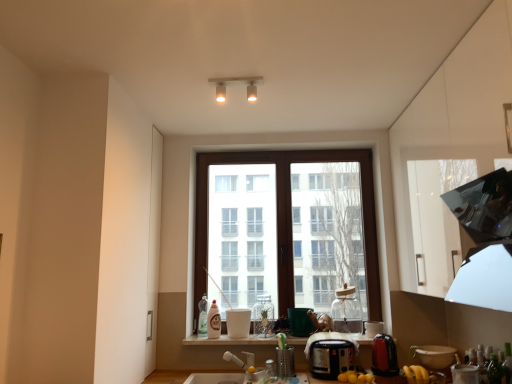
What do you see at coordinates (202, 316) in the screenshot? Image resolution: width=512 pixels, height=384 pixels. I see `translucent plastic bottle at window, which appears as the fourth bottle when viewed from the right` at bounding box center [202, 316].

You are a GUI agent. You are given a task and a screenshot of the screen. Output one action in this format:
    pyautogui.click(x=<x>, y=<y>)
    Task: Click on the white glossy bottle at center, the 3th bottle from the right
    The image size is (512, 384).
    Given the screenshot: What is the action you would take?
    pyautogui.click(x=214, y=321)

What is the approximate height of brown wooden window at center?

brown wooden window at center is 1.49 meters tall.

Image resolution: width=512 pixels, height=384 pixels. Describe the element at coordinates (289, 214) in the screenshot. I see `brown wooden window at center` at that location.

Locate an element on the screen. white glossy cup at center, which appears as the 1th appliance when viewed from the left is located at coordinates (238, 322).

Locate an element on the screen. appliance that is the 2nd one when counting forward from the white plastic faucet at lower center is located at coordinates (331, 358).

Considering the points (237, 359) and (352, 353), which point is behind, point (237, 359) or point (352, 353)?

The point (237, 359) is farther from the camera.

Which of these two, white plastic faucet at lower center or black plastic toaster at center, the third appliance viewed from the left, is bigger?

black plastic toaster at center, the third appliance viewed from the left.

In the scene shown: From the image's perspective, is white plastic faucet at lower center under black plastic toaster at center, the 4th appliance viewed from the right?

Yes.

Are brown wooden window at center and clear glass jar at center, the third bottle when ordered from back to front, far apart?

That's not correct — brown wooden window at center is a little close to clear glass jar at center, the third bottle when ordered from back to front.

Which is behind, point (369, 315) or point (256, 318)?

Point (256, 318)

Relative to clear glass jar at center, placed as the second bottle when sorted from right to left, is brown wooden window at center in front or behind?

brown wooden window at center is positioned farther from the viewer than clear glass jar at center, placed as the second bottle when sorted from right to left.

Is green matte mug at center, which ranks as the second appliance in left-to-right order, facing away from matte white bowl at lower right, marked as the sixth appliance in a left-to-right arrangement?

green matte mug at center, which ranks as the second appliance in left-to-right order, does not have its back to matte white bowl at lower right, marked as the sixth appliance in a left-to-right arrangement.

From the image's perspective, would you say green matte mug at center, which ranks as the second appliance in left-to-right order, is shown under matte white bowl at lower right, marked as the sixth appliance in a left-to-right arrangement?

No, from the image's perspective, green matte mug at center, which ranks as the second appliance in left-to-right order, is not below matte white bowl at lower right, marked as the sixth appliance in a left-to-right arrangement.

Does green matte mug at center, which ranks as the fifth appliance in right-to-left order, appear on the right side of matte white bowl at lower right, marked as the sixth appliance in a left-to-right arrangement?

Incorrect, green matte mug at center, which ranks as the fifth appliance in right-to-left order, is not on the right side of matte white bowl at lower right, marked as the sixth appliance in a left-to-right arrangement.

Is green matte mug at center, which ranks as the fifth appliance in right-to-left order, outside of matte white bowl at lower right, marked as the sixth appliance in a left-to-right arrangement?

Indeed, green matte mug at center, which ranks as the fifth appliance in right-to-left order, is completely outside matte white bowl at lower right, marked as the sixth appliance in a left-to-right arrangement.

Is green glass bottle at lower right, which is the first bottle from front to back, oriented towards brown wooden window at center?

No, green glass bottle at lower right, which is the first bottle from front to back, does not turn towards brown wooden window at center.

Which of these two, green glass bottle at lower right, which is the 1th bottle in right-to-left order, or brown wooden window at center, is smaller?

Smaller between the two is green glass bottle at lower right, which is the 1th bottle in right-to-left order.

Which of these two, green glass bottle at lower right, which appears as the fourth bottle when viewed from the back, or brown wooden window at center, stands taller?

Standing taller between the two is brown wooden window at center.

From a real-world perspective, which is physically above, green glass bottle at lower right, which is the 1th bottle in right-to-left order, or brown wooden window at center?

brown wooden window at center, from a real-world perspective.

Is point (411, 347) closer to viewer compared to point (245, 310)?

That is True.

Are matte white bowl at lower right, marked as the sixth appliance in a left-to-right arrangement, and white glossy cup at center, which appears as the 1th appliance when viewed from the left, far apart?

Absolutely, matte white bowl at lower right, marked as the sixth appliance in a left-to-right arrangement, is distant from white glossy cup at center, which appears as the 1th appliance when viewed from the left.

Between matte white bowl at lower right, acting as the 1th appliance starting from the right, and white glossy cup at center, marked as the sixth appliance in a right-to-left arrangement, which one has larger size?

white glossy cup at center, marked as the sixth appliance in a right-to-left arrangement, is bigger.

Locate an element on the screen. This screenshot has width=512, height=384. the 4th appliance below when counting from the white glossy cup at center, marked as the sixth appliance in a right-to-left arrangement (from the image's perspective) is located at coordinates (435, 356).

Which object is more forward, white glossy window sill at lower center or transparent glass jar at center, the 4th appliance positioned from the left?

Positioned in front is transparent glass jar at center, the 4th appliance positioned from the left.

Which of these two, white glossy window sill at lower center or transparent glass jar at center, the 3th appliance from the right, stands shorter?

With less height is white glossy window sill at lower center.

Is white glossy window sill at lower center directly adjacent to transparent glass jar at center, the 3th appliance from the right?

No, white glossy window sill at lower center is not making contact with transparent glass jar at center, the 3th appliance from the right.

Consider the image. From a real-world perspective, is white glossy window sill at lower center beneath transparent glass jar at center, the 3th appliance from the right?

Yes, from a real-world perspective, white glossy window sill at lower center is beneath transparent glass jar at center, the 3th appliance from the right.

Is black plastic toaster at center, the 4th appliance viewed from the right, not near translucent plastic bottle at window, which appears as the fourth bottle when viewed from the right?

No, black plastic toaster at center, the 4th appliance viewed from the right, is not far away from translucent plastic bottle at window, which appears as the fourth bottle when viewed from the right.

From the image's perspective, which object appears higher, black plastic toaster at center, the 4th appliance viewed from the right, or translucent plastic bottle at window, the first bottle from the left?

From the image's view, translucent plastic bottle at window, the first bottle from the left, is above.

Does point (326, 347) come farther from viewer compared to point (205, 335)?

No, (326, 347) is in front of (205, 335).

How far apart are black plastic toaster at center, the 4th appliance viewed from the right, and translucent plastic bottle at window, the first bottle from the left?

black plastic toaster at center, the 4th appliance viewed from the right, and translucent plastic bottle at window, the first bottle from the left, are 91.78 centimeters apart.

At what (x,y) coordinates should I click in order to perform the action: click on the 2nd appliance above the white plastic faucet at lower center (from the image's perspective). Please return your answer as a coordinate pair (x, y). This screenshot has width=512, height=384. Looking at the image, I should click on (331, 358).

You are a GUI agent. You are given a task and a screenshot of the screen. Output one action in this format:
    pyautogui.click(x=<x>, y=<y>)
    Task: Click on the bottle that is the 1st object located below the brown wooden window at center (from the image's perspective)
    The height and width of the screenshot is (384, 512).
    Given the screenshot: What is the action you would take?
    pyautogui.click(x=263, y=315)

Estimate the real-world distances between objects in this image. Which object is further from black plastic toaster at center, the third appliance viewed from the left, matte black kettle at lower right, positioned as the 2th appliance in right-to-left order, or clear glass jar at center, the third bottle when ordered from back to front?

clear glass jar at center, the third bottle when ordered from back to front, is further to black plastic toaster at center, the third appliance viewed from the left.

Based on their spatial positions, is translucent plastic bottle at window, placed as the 1th bottle when sorted from back to front, or white glossy bottle at center, which is the second bottle in back-to-front order, closer to white plastic faucet at lower center?

The object closer to white plastic faucet at lower center is white glossy bottle at center, which is the second bottle in back-to-front order.

From the picture: Looking at the image, which one is located further to white plastic faucet at lower center, black plastic toaster at center, the third appliance viewed from the left, or matte white light fixture at upper center?

matte white light fixture at upper center is further to white plastic faucet at lower center.

Considering their positions, is green matte mug at center, which ranks as the fifth appliance in right-to-left order, positioned closer to white glossy window sill at lower center than brown wooden window at center?

green matte mug at center, which ranks as the fifth appliance in right-to-left order.

Based on the photo, considering their positions, is white glossy bottle at center, the third bottle from the front, positioned closer to green glass bottle at lower right, which is the 1th bottle in right-to-left order, than matte white bowl at lower right, acting as the 1th appliance starting from the right?

matte white bowl at lower right, acting as the 1th appliance starting from the right, is closer to green glass bottle at lower right, which is the 1th bottle in right-to-left order.

Estimate the real-world distances between objects in this image. Which object is closer to clear glass jar at center, the 3th bottle in the left-to-right sequence, white glossy bottle at center, the third bottle from the front, or white glossy cup at center, which appears as the 1th appliance when viewed from the left?

white glossy cup at center, which appears as the 1th appliance when viewed from the left, is positioned closer to the anchor clear glass jar at center, the 3th bottle in the left-to-right sequence.

Estimate the real-world distances between objects in this image. Which object is closer to white glossy cup at center, marked as the sixth appliance in a right-to-left arrangement, translucent plastic bottle at window, the 4th bottle viewed from the front, or black plastic toaster at center, the 4th appliance viewed from the right?

translucent plastic bottle at window, the 4th bottle viewed from the front, lies closer to white glossy cup at center, marked as the sixth appliance in a right-to-left arrangement, than the other object.

Estimate the real-world distances between objects in this image. Which object is closer to transparent glass jar at center, the 3th appliance from the right, white plastic faucet at lower center or white glossy window sill at lower center?

white glossy window sill at lower center lies closer to transparent glass jar at center, the 3th appliance from the right, than the other object.

Where is `bottle situated between white plastic faucet at lower center and black plastic toaster at center, the 4th appliance viewed from the right, from left to right`? This screenshot has height=384, width=512. bottle situated between white plastic faucet at lower center and black plastic toaster at center, the 4th appliance viewed from the right, from left to right is located at coordinates (263, 315).

The width and height of the screenshot is (512, 384). Identify the location of bottle between black plastic toaster at center, the 4th appliance viewed from the right, and green matte mug at center, which ranks as the second appliance in left-to-right order, along the z-axis. (263, 315).

The width and height of the screenshot is (512, 384). I want to click on window between translucent plastic bottle at window, the 4th bottle viewed from the front, and matte white bowl at lower right, marked as the sixth appliance in a left-to-right arrangement, so click(289, 214).

Identify the location of window between translucent plastic bottle at window, placed as the 1th bottle when sorted from back to front, and green matte mug at center, which ranks as the fifth appliance in right-to-left order, in the horizontal direction. This screenshot has height=384, width=512. (289, 214).